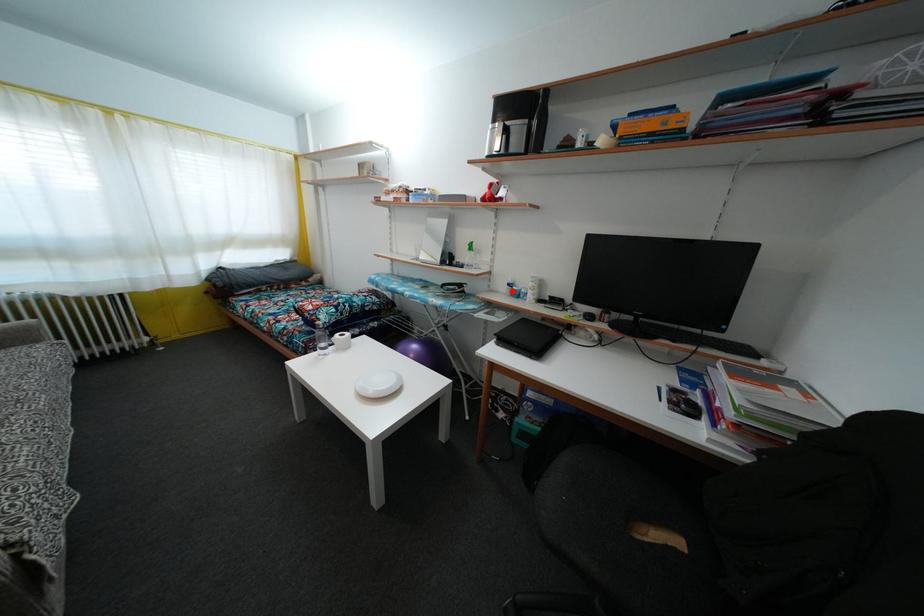
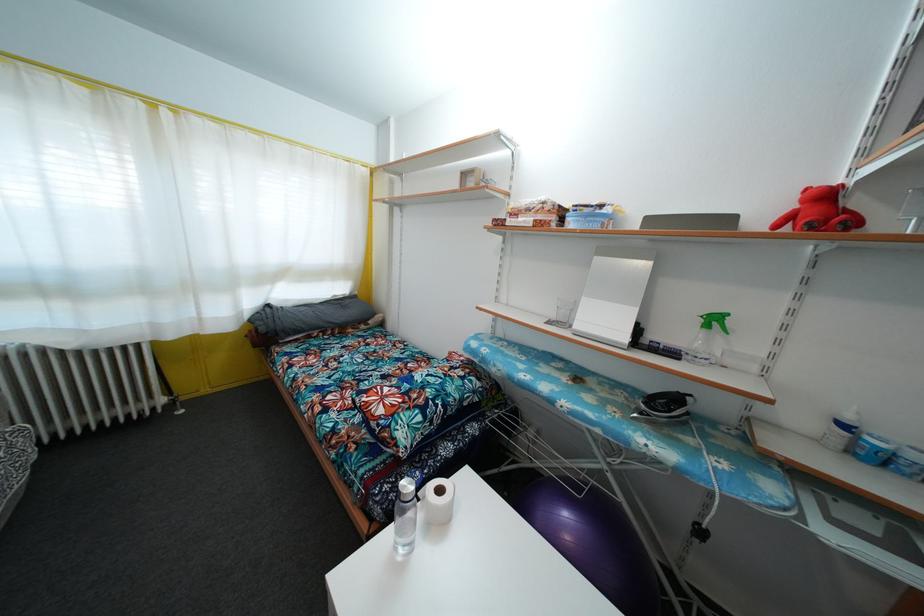
Locate, in the second image, the point that corresponds to the highlighted location in the first image.

(848, 432)